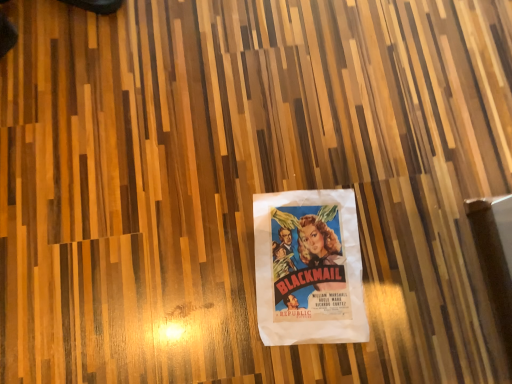
In order to click on free point above white paper poster at center (from a real-world perspective) in this screenshot , I will do `click(309, 273)`.